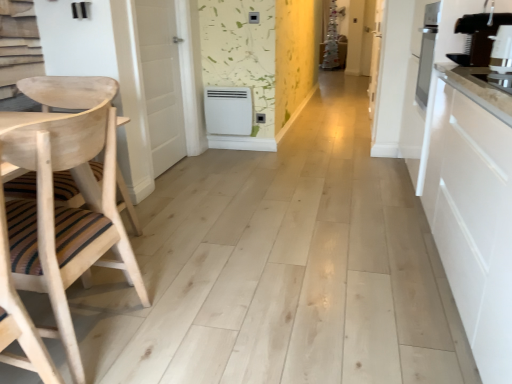
The image size is (512, 384). What do you see at coordinates (161, 80) in the screenshot?
I see `white smooth door at left, which appears as the first door when viewed from the left` at bounding box center [161, 80].

This screenshot has width=512, height=384. I want to click on white plastic heater at center, so click(x=228, y=110).

Find the location of a particular element. natural wood chair at left is located at coordinates (67, 207).

The width and height of the screenshot is (512, 384). What do you see at coordinates (478, 37) in the screenshot?
I see `black plastic coffee machine at right` at bounding box center [478, 37].

Image resolution: width=512 pixels, height=384 pixels. I want to click on white smooth door at left, the 2th door viewed from the back, so click(161, 80).

From a real-world perspective, is white wood door at center, arranged as the second door when viewed from the front, physically located above or below white plastic heater at center?

white wood door at center, arranged as the second door when viewed from the front, is above white plastic heater at center.

Can you confirm if white wood door at center, arranged as the second door when viewed from the front, is smaller than white plastic heater at center?

Indeed, white wood door at center, arranged as the second door when viewed from the front, has a smaller size compared to white plastic heater at center.

Based on the photo, from the image's perspective, is white wood door at center, the second door positioned from the left, located beneath white plastic heater at center?

No.

How different are the orientations of white wood door at center, which is the first door in back-to-front order, and white plastic heater at center in degrees?

89.9 degrees.

Could you tell me if natural wood chair at left is turned towards white smooth door at left, which appears as the first door when viewed from the left?

No.

Between natural wood chair at left and white smooth door at left, which is the 2th door in right-to-left order, which one has more height?

Standing taller between the two is white smooth door at left, which is the 2th door in right-to-left order.

How different are the orientations of natural wood chair at left and white smooth door at left, which is the 2th door in right-to-left order, in degrees?

180 degrees separate the facing orientations of natural wood chair at left and white smooth door at left, which is the 2th door in right-to-left order.

Can white smooth door at left, which is the 2th door in right-to-left order, be found inside black plastic coffee machine at right?

Definitely not — white smooth door at left, which is the 2th door in right-to-left order, is not inside black plastic coffee machine at right.

In terms of width, does black plastic coffee machine at right look wider or thinner when compared to white smooth door at left, the 2th door viewed from the back?

Considering their sizes, black plastic coffee machine at right looks broader than white smooth door at left, the 2th door viewed from the back.

Consider the image. How many degrees apart are the facing directions of black plastic coffee machine at right and white smooth door at left, the 2th door viewed from the back?

They differ by 178 degrees in their facing directions.

Are black plastic coffee machine at right and white smooth door at left, which is the 2th door in right-to-left order, located far from each other?

Indeed, black plastic coffee machine at right is not near white smooth door at left, which is the 2th door in right-to-left order.

Would you say natural wood chair at left is to the left or to the right of white plastic heater at center in the picture?

natural wood chair at left is to the left of white plastic heater at center.

Is natural wood chair at left oriented away from white plastic heater at center?

natural wood chair at left does not have its back to white plastic heater at center.

How far apart are natural wood chair at left and white plastic heater at center?

2.28 meters.

Is the depth of natural wood chair at left less than that of white plastic heater at center?

Yes, it is in front of white plastic heater at center.

From the image's perspective, who appears lower, natural wood chair at left or white wood door at center, arranged as the second door when viewed from the front?

natural wood chair at left.

How different are the orientations of natural wood chair at left and white wood door at center, which is counted as the first door, starting from the right, in degrees?

1.46 degrees separate the facing orientations of natural wood chair at left and white wood door at center, which is counted as the first door, starting from the right.

Does natural wood chair at left have a greater width compared to white wood door at center, arranged as the second door when viewed from the front?

Yes, natural wood chair at left is wider than white wood door at center, arranged as the second door when viewed from the front.

Where is `appliance below the white smooth door at left, the 2th door viewed from the back (from the image's perspective)`? appliance below the white smooth door at left, the 2th door viewed from the back (from the image's perspective) is located at coordinates (228, 110).

From their relative heights in the image, would you say white plastic heater at center is taller or shorter than white smooth door at left, which appears as the first door when viewed from the left?

In the image, white plastic heater at center appears to be shorter than white smooth door at left, which appears as the first door when viewed from the left.

Considering the relative sizes of white plastic heater at center and white smooth door at left, which appears as the 1th door when viewed from the front, in the image provided, is white plastic heater at center wider than white smooth door at left, which appears as the 1th door when viewed from the front,?

Correct, the width of white plastic heater at center exceeds that of white smooth door at left, which appears as the 1th door when viewed from the front.

Is white plastic heater at center positioned far away from white smooth door at left, which is the 2th door in right-to-left order?

That's not correct — white plastic heater at center is a little close to white smooth door at left, which is the 2th door in right-to-left order.

From the image's perspective, is white plastic heater at center below natural wood chair at left?

No.

In the image, is white plastic heater at center positioned in front of or behind natural wood chair at left?

In the image, white plastic heater at center appears behind natural wood chair at left.

From a real-world perspective, which is physically above, white plastic heater at center or natural wood chair at left?

natural wood chair at left is physically above.

At what (x,y) coordinates should I click in order to perform the action: click on appliance below the white wood door at center, which is counted as the first door, starting from the right (from a real-world perspective). Please return your answer as a coordinate pair (x, y). Looking at the image, I should click on (228, 110).

Locate an element on the screen. The width and height of the screenshot is (512, 384). chair below the white smooth door at left, the 2th door viewed from the back (from the image's perspective) is located at coordinates (67, 207).

Considering their positions, is natural wood chair at left positioned further to black plastic coffee machine at right than white smooth door at left, which appears as the 1th door when viewed from the front?

white smooth door at left, which appears as the 1th door when viewed from the front.

Based on their spatial positions, is white smooth door at left, which appears as the first door when viewed from the left, or black plastic coffee machine at right closer to white plastic heater at center?

white smooth door at left, which appears as the first door when viewed from the left, is positioned closer to the anchor white plastic heater at center.

Which object lies nearer to the anchor point black plastic coffee machine at right, white smooth door at left, which appears as the 1th door when viewed from the front, or natural wood chair at left?

natural wood chair at left is positioned closer to the anchor black plastic coffee machine at right.

When comparing their distances from white smooth door at left, which is the 2th door in right-to-left order, does white wood door at center, the second door positioned from the left, or white plastic heater at center seem further?

white wood door at center, the second door positioned from the left.

When comparing their distances from white smooth door at left, which appears as the 1th door when viewed from the front, does white plastic heater at center or black plastic coffee machine at right seem further?

black plastic coffee machine at right is positioned further to the anchor white smooth door at left, which appears as the 1th door when viewed from the front.

Looking at the image, which one is located closer to white plastic heater at center, black plastic coffee machine at right or white smooth door at left, which is the 2th door in right-to-left order?

white smooth door at left, which is the 2th door in right-to-left order.

From the image, which object appears to be farther from black plastic coffee machine at right, white plastic heater at center or white wood door at center, the second door positioned from the left?

white plastic heater at center lies further to black plastic coffee machine at right than the other object.

Looking at the image, which one is located further to black plastic coffee machine at right, white smooth door at left, which appears as the 1th door when viewed from the front, or white plastic heater at center?

Based on the image, white plastic heater at center appears to be further to black plastic coffee machine at right.

The image size is (512, 384). In order to click on coffee machine between natural wood chair at left and white plastic heater at center in the front-back direction in this screenshot , I will do `click(478, 37)`.

I want to click on door between black plastic coffee machine at right and white wood door at center, the second door positioned from the left, along the z-axis, so click(161, 80).

Find the location of a particular element. The width and height of the screenshot is (512, 384). door located between black plastic coffee machine at right and white plastic heater at center in the depth direction is located at coordinates (161, 80).

Locate an element on the screen. door located between natural wood chair at left and black plastic coffee machine at right in the left-right direction is located at coordinates (161, 80).